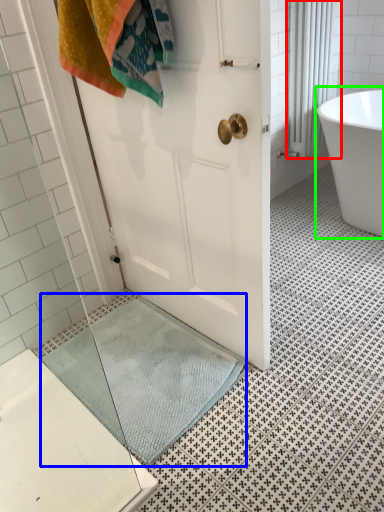
Question: Which object is positioned farthest from shower curtain (highlighted by a red box)? Select from bath mat (highlighted by a blue box) and bathtub (highlighted by a green box).

Choices:
 (A) bath mat
 (B) bathtub

Answer: (A)